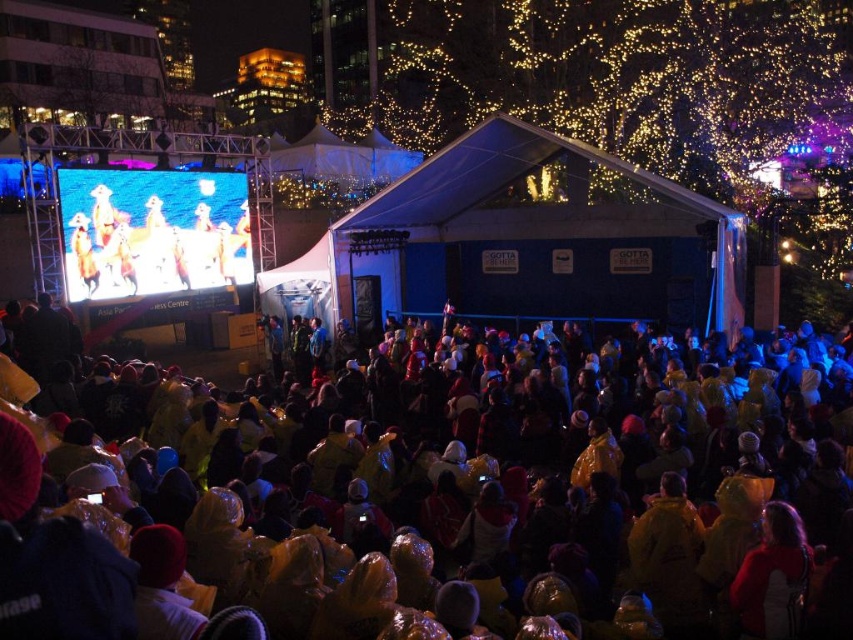
Is yellow raincoats at lower center further to camera compared to matte black screen at upper left?

No, yellow raincoats at lower center is closer to the viewer.

How far apart are yellow raincoats at lower center and matte black screen at upper left?

20.29 meters

Where is `yellow raincoats at lower center`? yellow raincoats at lower center is located at coordinates (519, 486).